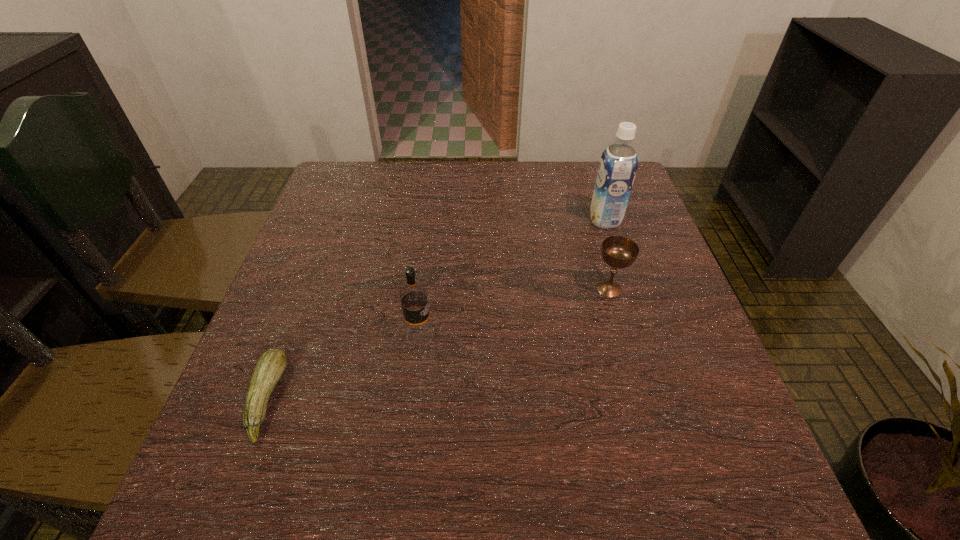
I want to click on the farthest object, so click(618, 164).

I want to click on the tallest object, so click(618, 164).

You are a GUI agent. You are given a task and a screenshot of the screen. Output one action in this format:
    pyautogui.click(x=<x>, y=<y>)
    Task: Click on the third object from right to left
    The image size is (960, 540).
    Given the screenshot: What is the action you would take?
    pyautogui.click(x=419, y=332)

Find the location of a particular element. The height and width of the screenshot is (540, 960). the third farthest object is located at coordinates (419, 332).

Locate an element on the screen. Image resolution: width=960 pixels, height=540 pixels. chalice is located at coordinates (619, 252).

Identify the location of the second shortest object. (619, 252).

Identify the location of the shortest object. (271, 365).

Identify the location of zucchini. (271, 365).

The height and width of the screenshot is (540, 960). I want to click on vacant point located on the label of the tallest object, so click(x=479, y=220).

This screenshot has width=960, height=540. What are the coordinates of `free space located 0.190m on the label of the tallest object` in the screenshot? It's located at (517, 220).